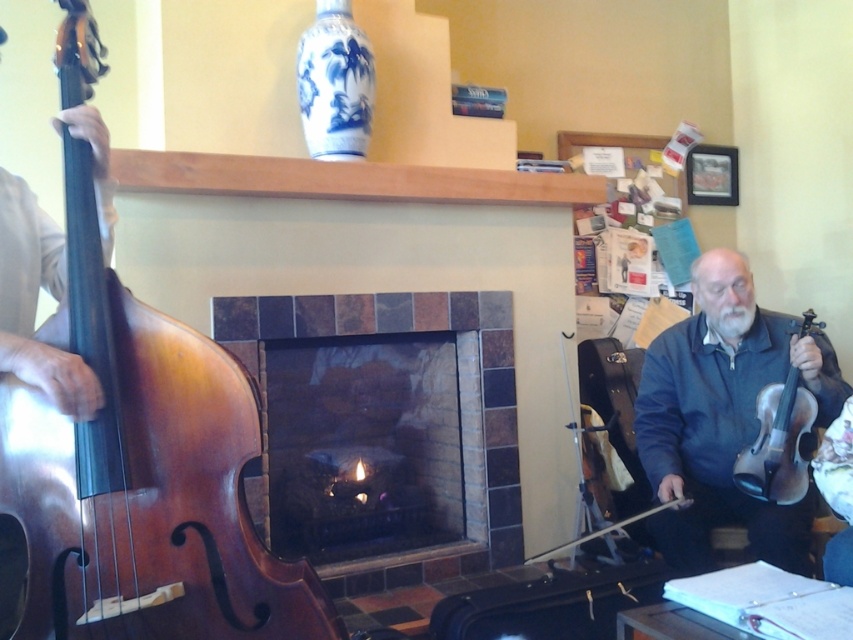
Question: Is marble tiled fireplace at center to the right of wooden violin at right from the viewer's perspective?

Choices:
 (A) no
 (B) yes

Answer: (A)

Question: Does shiny brown wood cello at left have a lesser width compared to marble tiled fireplace at center?

Choices:
 (A) yes
 (B) no

Answer: (A)

Question: Which point is closer to the camera?

Choices:
 (A) shiny brown wood cello at left
 (B) dark blue fabric jacket at right
 (C) wooden violin at right
 (D) marble tiled fireplace at center

Answer: (A)

Question: Which point is farther from the camera taking this photo?

Choices:
 (A) (381, 333)
 (B) (775, 444)
 (C) (759, 525)
 (D) (65, 29)

Answer: (A)

Question: Does shiny brown wood cello at left appear under marble tiled fireplace at center?

Choices:
 (A) yes
 (B) no

Answer: (B)

Question: Which is farther from the shiny brown wood cello at left?

Choices:
 (A) wooden violin at right
 (B) dark blue fabric jacket at right
 (C) marble tiled fireplace at center

Answer: (A)